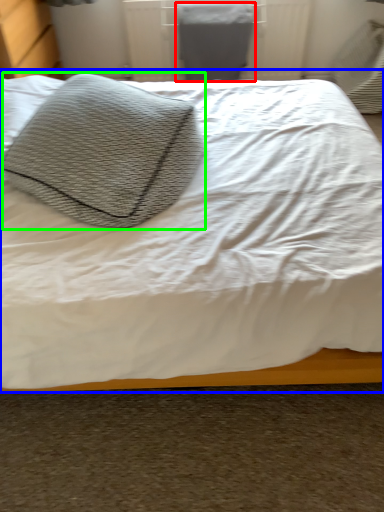
Question: Which object is the closest to the gray (highlighted by a red box)? Choose among these: bed (highlighted by a blue box) or throw pillow (highlighted by a green box).

Choices:
 (A) bed
 (B) throw pillow

Answer: (A)